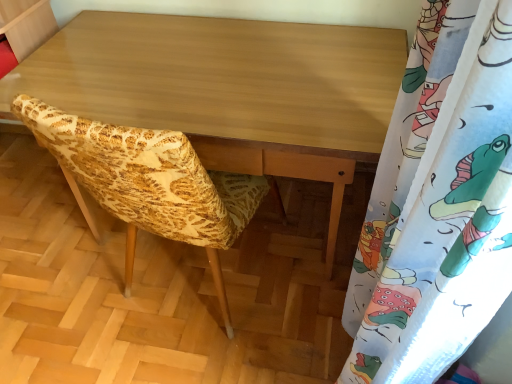
Find the location of a particular element. vacant space that is to the left of white fabric with colorful cartoon print at right is located at coordinates (231, 339).